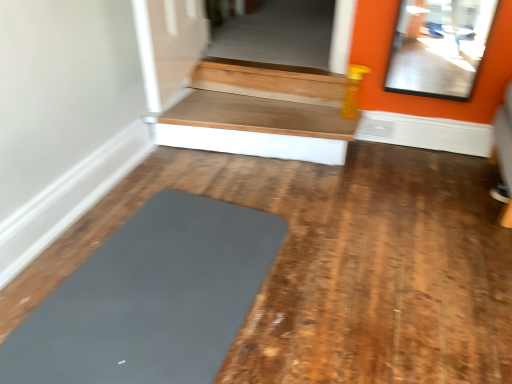
Locate an element on the screen. The height and width of the screenshot is (384, 512). wooden at upper right is located at coordinates (261, 113).

The width and height of the screenshot is (512, 384). What do you see at coordinates (261, 113) in the screenshot?
I see `wooden at upper right` at bounding box center [261, 113].

Describe the element at coordinates (150, 298) in the screenshot. I see `matte gray yoga mat at center` at that location.

Find the location of a particular element. matte gray yoga mat at center is located at coordinates (150, 298).

Find the location of a particular element. This screenshot has width=512, height=384. wooden at upper right is located at coordinates (261, 113).

Which object is positioned more to the right, wooden at upper right or matte gray yoga mat at center?

Positioned to the right is wooden at upper right.

Which is in front, wooden at upper right or matte gray yoga mat at center?

matte gray yoga mat at center is in front.

Does point (271, 127) appear closer or farther from the camera than point (172, 353)?

Point (271, 127) appears to be farther away from the viewer than point (172, 353).

From the image's perspective, would you say wooden at upper right is shown under matte gray yoga mat at center?

No, from the image's perspective, wooden at upper right is not beneath matte gray yoga mat at center.

From a real-world perspective, is wooden at upper right physically located above or below matte gray yoga mat at center?

wooden at upper right is situated higher than matte gray yoga mat at center in the real world.

Does wooden at upper right have a greater width compared to matte gray yoga mat at center?

Incorrect, the width of wooden at upper right does not surpass that of matte gray yoga mat at center.

Is wooden at upper right taller than matte gray yoga mat at center?

Yes.

Does wooden at upper right have a larger size compared to matte gray yoga mat at center?

Indeed, wooden at upper right has a larger size compared to matte gray yoga mat at center.

Is wooden at upper right inside the boundaries of matte gray yoga mat at center, or outside?

wooden at upper right cannot be found inside matte gray yoga mat at center.

Would you consider wooden at upper right to be distant from matte gray yoga mat at center?

They are positioned close to each other.

In the scene shown: Is wooden at upper right positioned with its back to matte gray yoga mat at center?

That's not correct — wooden at upper right is not looking away from matte gray yoga mat at center.

Locate an element on the screen. stairwell that is above the matte gray yoga mat at center (from a real-world perspective) is located at coordinates (261, 113).

Looking at this image, would you say matte gray yoga mat at center is to the left or to the right of wooden at upper right in the picture?

Based on their positions, matte gray yoga mat at center is located to the left of wooden at upper right.

In the scene shown: Is matte gray yoga mat at center positioned before wooden at upper right?

Yes, matte gray yoga mat at center is closer to the camera.

Is point (268, 267) farther from viewer compared to point (340, 86)?

No, it is in front of (340, 86).

Looking at this image, from the image's perspective, would you say matte gray yoga mat at center is shown under wooden at upper right?

Indeed, from the image's perspective, matte gray yoga mat at center is shown beneath wooden at upper right.

From a real-world perspective, is matte gray yoga mat at center positioned above or below wooden at upper right?

Clearly, from a real-world perspective, matte gray yoga mat at center is below wooden at upper right.

Which object is wider, matte gray yoga mat at center or wooden at upper right?

matte gray yoga mat at center is wider.

From their relative heights in the image, would you say matte gray yoga mat at center is taller or shorter than wooden at upper right?

In the image, matte gray yoga mat at center appears to be shorter than wooden at upper right.

Which of these two, matte gray yoga mat at center or wooden at upper right, is bigger?

wooden at upper right is bigger.

Is matte gray yoga mat at center positioned beyond the bounds of wooden at upper right?

matte gray yoga mat at center lies outside wooden at upper right's area.

In the scene shown: Is matte gray yoga mat at center beside wooden at upper right?

matte gray yoga mat at center and wooden at upper right are clearly separated.

Is wooden at upper right at the back of matte gray yoga mat at center?

No, matte gray yoga mat at center's orientation is not away from wooden at upper right.

What's the angular difference between matte gray yoga mat at center and wooden at upper right's facing directions?

There is a 179-degree angle between the facing directions of matte gray yoga mat at center and wooden at upper right.

Measure the distance between matte gray yoga mat at center and wooden at upper right.

matte gray yoga mat at center and wooden at upper right are 33.53 inches apart from each other.

This screenshot has width=512, height=384. Find the location of `stairwell above the matte gray yoga mat at center (from the image's perspective)`. stairwell above the matte gray yoga mat at center (from the image's perspective) is located at coordinates (261, 113).

Where is `yoga that is in front of the wooden at upper right`? The image size is (512, 384). yoga that is in front of the wooden at upper right is located at coordinates (150, 298).

The width and height of the screenshot is (512, 384). Find the location of `stairwell behind the matte gray yoga mat at center`. stairwell behind the matte gray yoga mat at center is located at coordinates tap(261, 113).